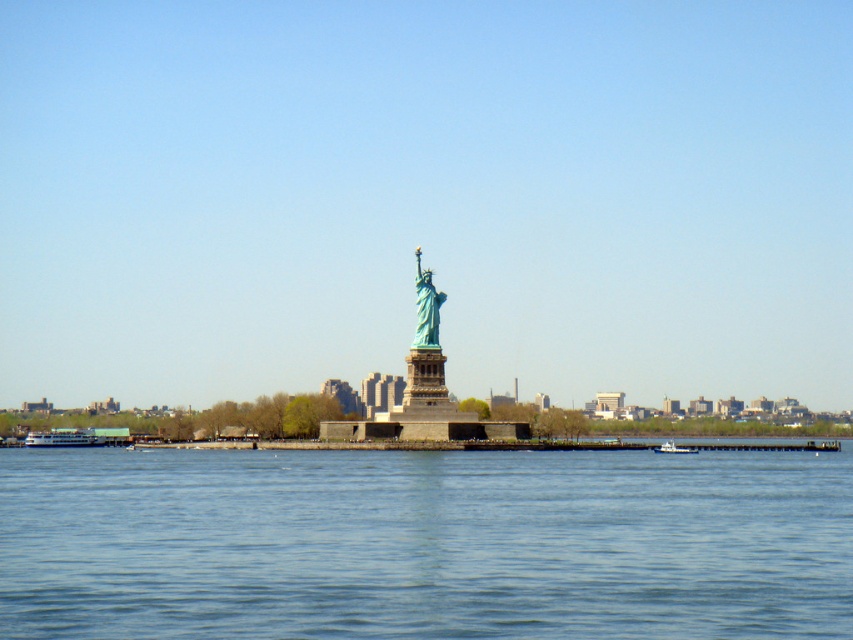
You are a tourist on a boat in New York Harbor and want to take a photo of the Statue of Liberty with both the white glossy ferry at lower left and the metallic gray boat at lower right in the frame. Based on their positions, which boat should be closer to the left side of your photo?

The white glossy ferry at lower left is to the left of the metallic gray boat at lower right, so the white glossy ferry at lower left should be closer to the left side of your photo.

You are a tourist standing on the dock near the Statue of Liberty. You see the blue liquid water at center and the metallic gray boat at lower right. Which object is closer to your right side?

The metallic gray boat at lower right is closer to your right side because it is positioned to the right of the blue liquid water at center.

From the picture: You are standing at the edge of the water in the image. If you want to reach the Statue of Liberty, which is on the island, would you need to cross the blue liquid water at center?

Yes, you would need to cross the blue liquid water at center to reach the Statue of Liberty since it is located on Liberty Island, which is surrounded by water.